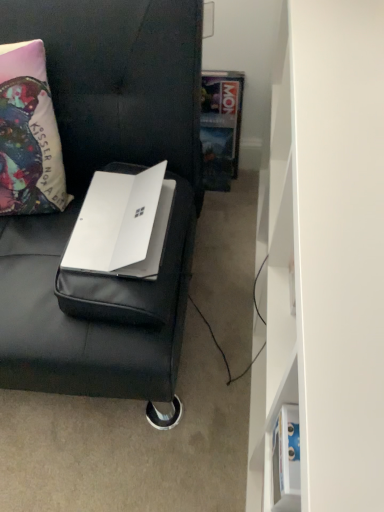
Question: From a real-world perspective, is white matte laptop at left physically located above or below hardcover book at center?

Choices:
 (A) below
 (B) above

Answer: (B)

Question: Choose the correct answer: Is white matte laptop at left inside hardcover book at center or outside it?

Choices:
 (A) inside
 (B) outside

Answer: (B)

Question: Considering the real-world distances, which object is farthest from the white matte bookshelf at right?

Choices:
 (A) white matte laptop at center
 (B) white matte laptop at left
 (C) hardcover book at center
 (D) matte fabric pillow at left

Answer: (D)

Question: Estimate the real-world distances between objects in this image. Which object is closer to the white matte bookshelf at right?

Choices:
 (A) matte fabric pillow at left
 (B) white matte laptop at center
 (C) hardcover book at center
 (D) white matte laptop at left

Answer: (D)